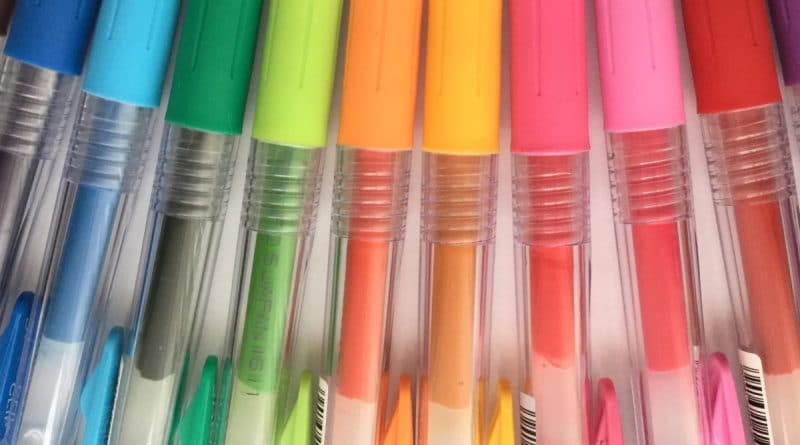
Where is `colored pens`? This screenshot has height=445, width=800. colored pens is located at coordinates (29, 89), (116, 109), (209, 125), (286, 140), (366, 134), (458, 130), (554, 130), (653, 121), (742, 109), (794, 48).